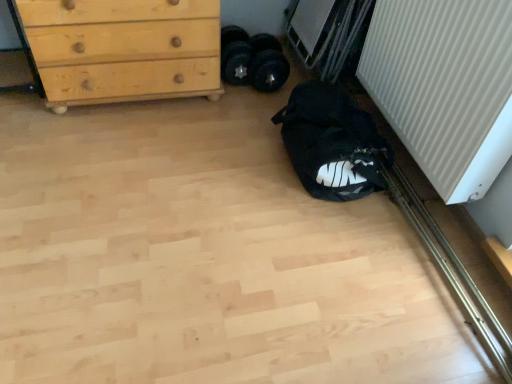
I want to click on free location to the left of black fabric bag at lower right, so click(x=219, y=147).